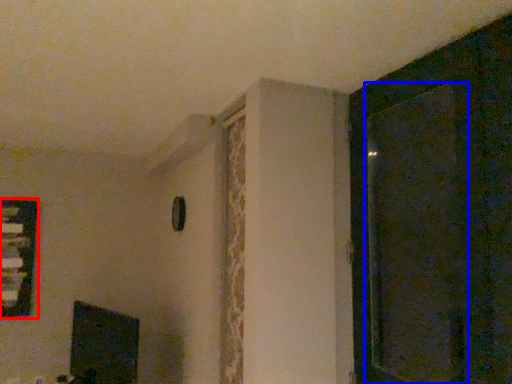
Question: Which object is further to the camera taking this photo, window (highlighted by a red box) or screen door (highlighted by a blue box)?

Choices:
 (A) window
 (B) screen door

Answer: (A)